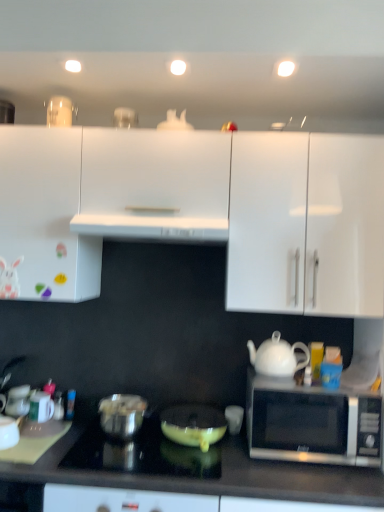
What is the approximate width of white plastic exhaust hood at center?

18.62 inches.

The height and width of the screenshot is (512, 384). Find the location of `white glossy cabinet at left, arranged as the 1th cabinetry when viewed from the left`. white glossy cabinet at left, arranged as the 1th cabinetry when viewed from the left is located at coordinates (44, 217).

Measure the distance between point (188, 190) and camera.

Point (188, 190) and camera are 1.67 meters apart.

This screenshot has height=512, width=384. I want to click on shiny metallic pot at lower left, placed as the 2th appliance when sorted from right to left, so click(x=122, y=415).

What do you see at coordinates (311, 422) in the screenshot? This screenshot has height=512, width=384. I see `sleek silver microwave at right` at bounding box center [311, 422].

Measure the distance between sleek silver microwave at right and camera.

The depth of sleek silver microwave at right is 5.00 feet.

This screenshot has width=384, height=512. I want to click on white plastic exhaust hood at center, so click(x=151, y=227).

Between point (172, 424) and point (264, 430), which one is positioned behind?

The point (172, 424) is farther from the camera.

From a real-world perspective, between matte yellow frying pan at center, the first appliance from the right, and sleek silver microwave at right, who is vertically higher?

From a 3D spatial view, sleek silver microwave at right is above.

Does matte yellow frying pan at center, the first appliance from the right, have a smaller size compared to sleek silver microwave at right?

Yes.

Based on the photo, from the image's perspective, which object appears higher, white glossy cabinet at left, arranged as the 1th cabinetry when viewed from the left, or black glossy countertop at lower center?

white glossy cabinet at left, arranged as the 1th cabinetry when viewed from the left.

Is white glossy cabinet at left, the third cabinetry positioned from the right, not inside black glossy countertop at lower center?

Yes, white glossy cabinet at left, the third cabinetry positioned from the right, is outside of black glossy countertop at lower center.

Who is more distant, white glossy cabinet at left, arranged as the 1th cabinetry when viewed from the left, or black glossy countertop at lower center?

white glossy cabinet at left, arranged as the 1th cabinetry when viewed from the left.

Does white glossy cabinet at left, the third cabinetry positioned from the right, turn towards black glossy countertop at lower center?

No, white glossy cabinet at left, the third cabinetry positioned from the right, does not turn towards black glossy countertop at lower center.

The height and width of the screenshot is (512, 384). I want to click on kitchen appliance below the white glossy cabinet at left, arranged as the 1th cabinetry when viewed from the left (from a real-world perspective), so click(x=8, y=432).

How many degrees apart are the facing directions of white glossy cabinet at left, the third cabinetry positioned from the right, and white glossy mug at lower left?

They differ by 3.13 degrees in their facing directions.

Considering the sizes of objects white glossy cabinet at left, arranged as the 1th cabinetry when viewed from the left, and white glossy mug at lower left in the image provided, who is taller, white glossy cabinet at left, arranged as the 1th cabinetry when viewed from the left, or white glossy mug at lower left?

Standing taller between the two is white glossy cabinet at left, arranged as the 1th cabinetry when viewed from the left.

From a real-world perspective, is white glossy cabinet at left, the third cabinetry positioned from the right, physically located above or below white glossy mug at lower left?

In terms of real-world spatial position, white glossy cabinet at left, the third cabinetry positioned from the right, is above white glossy mug at lower left.

Is white glossy teapot at right facing away from matte yellow frying pan at center, which is counted as the 3th appliance, starting from the left?

That's not correct — white glossy teapot at right is not looking away from matte yellow frying pan at center, which is counted as the 3th appliance, starting from the left.

Is white glossy teapot at right taller than matte yellow frying pan at center, the first appliance from the right?

Yes, white glossy teapot at right is taller than matte yellow frying pan at center, the first appliance from the right.

Which is more to the left, white glossy teapot at right or matte yellow frying pan at center, which is counted as the 3th appliance, starting from the left?

matte yellow frying pan at center, which is counted as the 3th appliance, starting from the left.

Which is behind, white glossy teapot at right or matte yellow frying pan at center, which is counted as the 3th appliance, starting from the left?

Positioned behind is white glossy teapot at right.

Does white matte cabinet at center, positioned as the second cabinetry in right-to-left order, have a lesser height compared to sleek silver microwave at right?

In fact, white matte cabinet at center, positioned as the second cabinetry in right-to-left order, may be taller than sleek silver microwave at right.

Does point (168, 224) appear closer or farther from the camera than point (376, 441)?

Clearly, point (168, 224) is more distant from the camera than point (376, 441).

From the picture: Does white matte cabinet at center, the second cabinetry positioned from the left, appear on the right side of sleek silver microwave at right?

No.

This screenshot has width=384, height=512. What are the coordinates of `countertop below the white matte cabinet at center, the second cabinetry positioned from the left (from the image's perspective)` in the screenshot? It's located at point(222,477).

Who is smaller, white matte cabinet at center, positioned as the second cabinetry in right-to-left order, or black glossy countertop at lower center?

Smaller between the two is white matte cabinet at center, positioned as the second cabinetry in right-to-left order.

From the image's perspective, is white matte cabinet at center, positioned as the second cabinetry in right-to-left order, positioned above or below black glossy countertop at lower center?

white matte cabinet at center, positioned as the second cabinetry in right-to-left order, is above black glossy countertop at lower center.

Is white matte cabinet at center, positioned as the second cabinetry in right-to-left order, located outside black glossy countertop at lower center?

Indeed, white matte cabinet at center, positioned as the second cabinetry in right-to-left order, is completely outside black glossy countertop at lower center.

Is white glossy teapot at right positioned far away from white matte cabinet at center, the second cabinetry positioned from the left?

They are positioned close to each other.

Which object is closer to the camera, white glossy teapot at right or white matte cabinet at center, the second cabinetry positioned from the left?

white glossy teapot at right is closer to the camera.

The width and height of the screenshot is (384, 512). Find the location of `cabinetry that is the 3rd object located above the white glossy teapot at right (from the image's perspective)`. cabinetry that is the 3rd object located above the white glossy teapot at right (from the image's perspective) is located at coordinates (154, 184).

Locate an element on the screen. The width and height of the screenshot is (384, 512). microwave oven behind the matte yellow frying pan at center, which is counted as the 3th appliance, starting from the left is located at coordinates (311, 422).

Where is `countertop lying on the right of white glossy cabinet at left, arranged as the 1th cabinetry when viewed from the left`? Image resolution: width=384 pixels, height=512 pixels. countertop lying on the right of white glossy cabinet at left, arranged as the 1th cabinetry when viewed from the left is located at coordinates (222, 477).

Considering their positions, is matte yellow frying pan at center, which is counted as the 3th appliance, starting from the left, positioned further to white glossy kettle at lower left, the first appliance in the left-to-right sequence, than shiny metallic pot at lower left, placed as the 2th appliance when sorted from right to left?

matte yellow frying pan at center, which is counted as the 3th appliance, starting from the left, is further to white glossy kettle at lower left, the first appliance in the left-to-right sequence.

When comparing their distances from shiny black cooktop at center, does white glossy cabinet at left, the third cabinetry positioned from the right, or white glossy cabinet at upper right, acting as the 1th cabinetry starting from the right, seem further?

Among the two, white glossy cabinet at upper right, acting as the 1th cabinetry starting from the right, is located further to shiny black cooktop at center.

Considering their positions, is white glossy kettle at lower left, the third appliance in the right-to-left sequence, positioned closer to sleek silver microwave at right than white glossy cabinet at left, the third cabinetry positioned from the right?

The object closer to sleek silver microwave at right is white glossy kettle at lower left, the third appliance in the right-to-left sequence.

When comparing their distances from white glossy cabinet at left, the third cabinetry positioned from the right, does white matte cabinet at center, positioned as the second cabinetry in right-to-left order, or shiny metallic pot at lower left, placed as the 2th appliance when sorted from right to left, seem further?

The object further to white glossy cabinet at left, the third cabinetry positioned from the right, is shiny metallic pot at lower left, placed as the 2th appliance when sorted from right to left.

Based on their spatial positions, is white glossy teapot at right or white glossy cabinet at upper right, which is counted as the third cabinetry, starting from the left, further from shiny black cooktop at center?

white glossy cabinet at upper right, which is counted as the third cabinetry, starting from the left.

Based on their spatial positions, is white glossy cabinet at upper right, which is counted as the third cabinetry, starting from the left, or shiny black cooktop at center closer to sleek silver microwave at right?

shiny black cooktop at center.

Based on their spatial positions, is white glossy kettle at lower left, the first appliance in the left-to-right sequence, or white matte cabinet at center, positioned as the second cabinetry in right-to-left order, closer to white glossy cabinet at left, arranged as the 1th cabinetry when viewed from the left?

white matte cabinet at center, positioned as the second cabinetry in right-to-left order, is closer to white glossy cabinet at left, arranged as the 1th cabinetry when viewed from the left.

Based on their spatial positions, is white glossy teapot at right or white glossy kettle at lower left, the first appliance in the left-to-right sequence, further from shiny black cooktop at center?

Based on the image, white glossy teapot at right appears to be further to shiny black cooktop at center.

This screenshot has height=512, width=384. I want to click on gas stove between white plastic exhaust hood at center and black glossy countertop at lower center in the vertical direction, so click(x=141, y=454).

Find the location of a particular element. kitchen appliance between white plastic exhaust hood at center and black glossy countertop at lower center vertically is located at coordinates (8, 432).

Where is `teapot between white glossy cabinet at left, the third cabinetry positioned from the right, and white glossy cabinet at upper right, acting as the 1th cabinetry starting from the right, in the horizontal direction`? teapot between white glossy cabinet at left, the third cabinetry positioned from the right, and white glossy cabinet at upper right, acting as the 1th cabinetry starting from the right, in the horizontal direction is located at coordinates (277, 357).

Find the location of a particular element. The image size is (384, 512). microwave oven between white glossy cabinet at upper right, which is counted as the third cabinetry, starting from the left, and matte yellow frying pan at center, which is counted as the 3th appliance, starting from the left, from top to bottom is located at coordinates (311, 422).